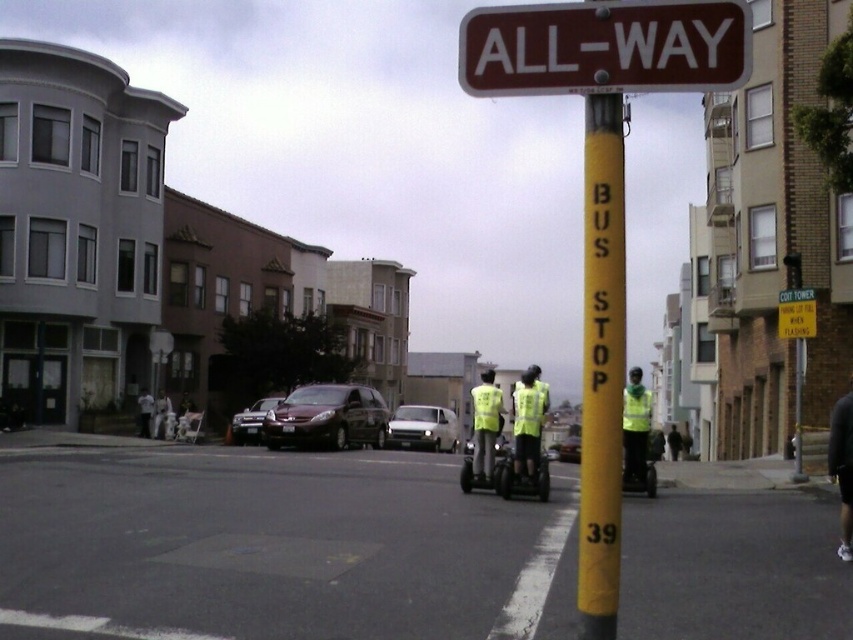
Is yellow matte pole at center-right to the left of white matte car at center from the viewer's perspective?

No, yellow matte pole at center-right is not to the left of white matte car at center.

Does yellow matte pole at center-right appear on the right side of white matte car at center?

Correct, you'll find yellow matte pole at center-right to the right of white matte car at center.

Does point (595, 502) come farther from viewer compared to point (399, 422)?

No.

At what (x,y) coordinates should I click in order to perform the action: click on yellow matte pole at center-right. Please return your answer as a coordinate pair (x, y). Looking at the image, I should click on (601, 365).

Who is positioned more to the left, shiny black sedan at center-left or reflective yellow safety vest at center?

Positioned to the left is shiny black sedan at center-left.

Who is more distant from viewer, (250, 426) or (648, 401)?

The point (250, 426) is behind.

Locate an element on the screen. The width and height of the screenshot is (853, 640). shiny black sedan at center-left is located at coordinates (251, 420).

Which is more to the right, white matte car at center or reflective yellow safety vest at center?

reflective yellow safety vest at center

Does point (403, 413) lie in front of point (624, 394)?

No.

Where is `white matte car at center`? white matte car at center is located at coordinates (422, 428).